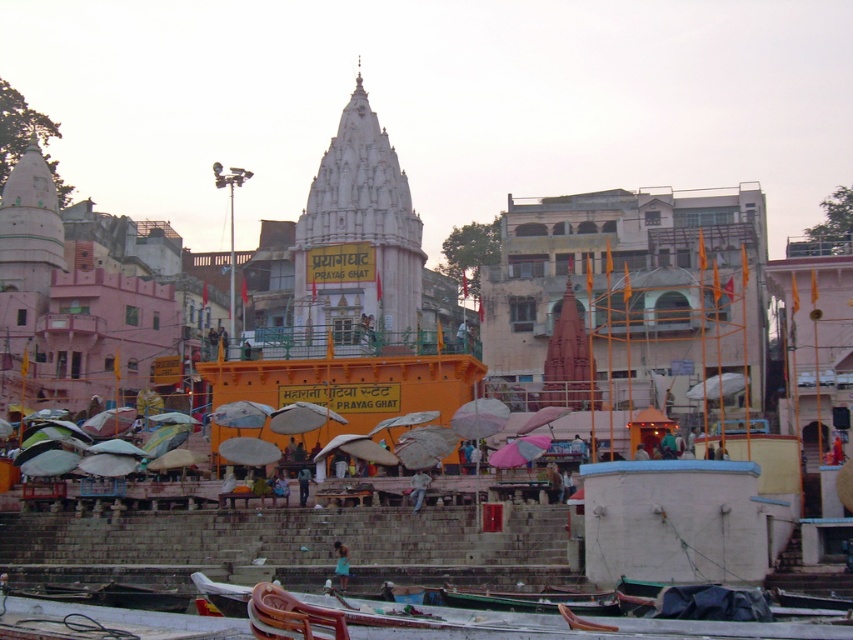
Question: Can you confirm if wooden boat at lower center is thinner than white fabric umbrella at center?

Choices:
 (A) yes
 (B) no

Answer: (B)

Question: Does wooden boat at lower center appear under white fabric umbrella at center?

Choices:
 (A) yes
 (B) no

Answer: (A)

Question: Which of the following is the closest to the observer?

Choices:
 (A) blue fabric person at lower center
 (B) white fabric umbrella at center

Answer: (A)

Question: Is orange painted temple at center thinner than blue fabric person at lower center?

Choices:
 (A) yes
 (B) no

Answer: (B)

Question: Which of the following is the farthest from the observer?

Choices:
 (A) (724, 376)
 (B) (419, 481)
 (C) (554, 596)
 (D) (683, 248)

Answer: (D)

Question: Considering the real-world distances, which object is farthest from the orange painted temple at center?

Choices:
 (A) blue fabric person at lower center
 (B) wooden boat at lower center
 (C) light blue jeans at center

Answer: (A)